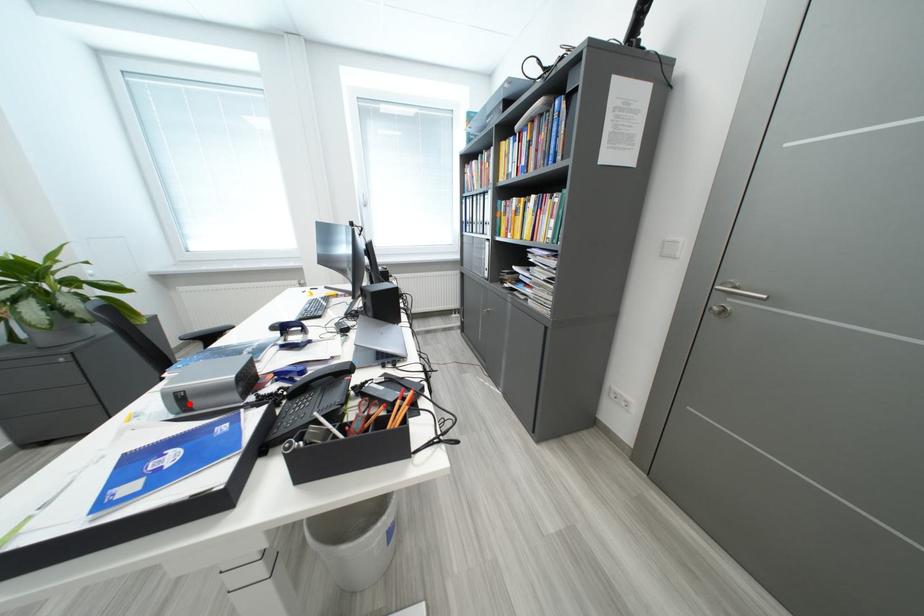
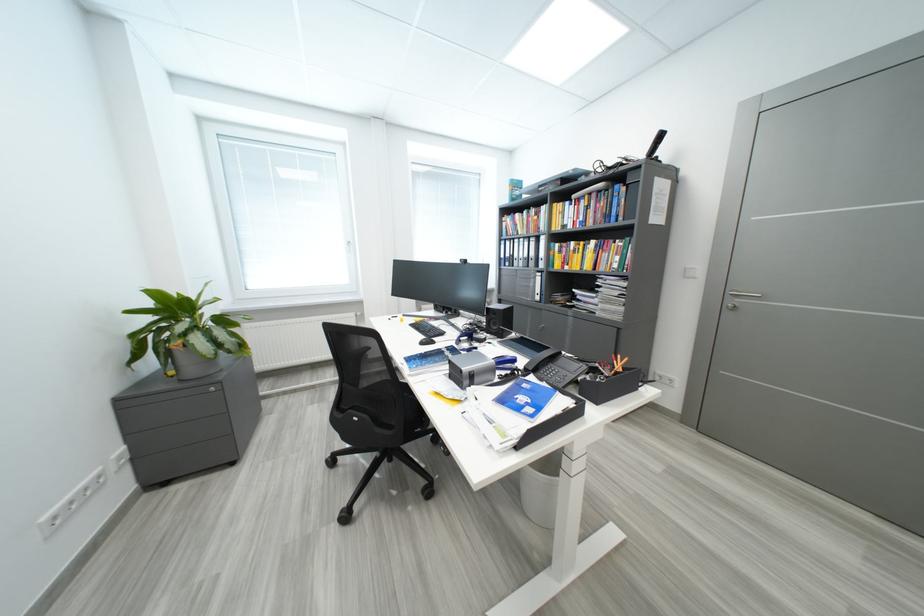
Locate, in the second image, the point that corresponds to the highlighted location in the first image.

(481, 381)